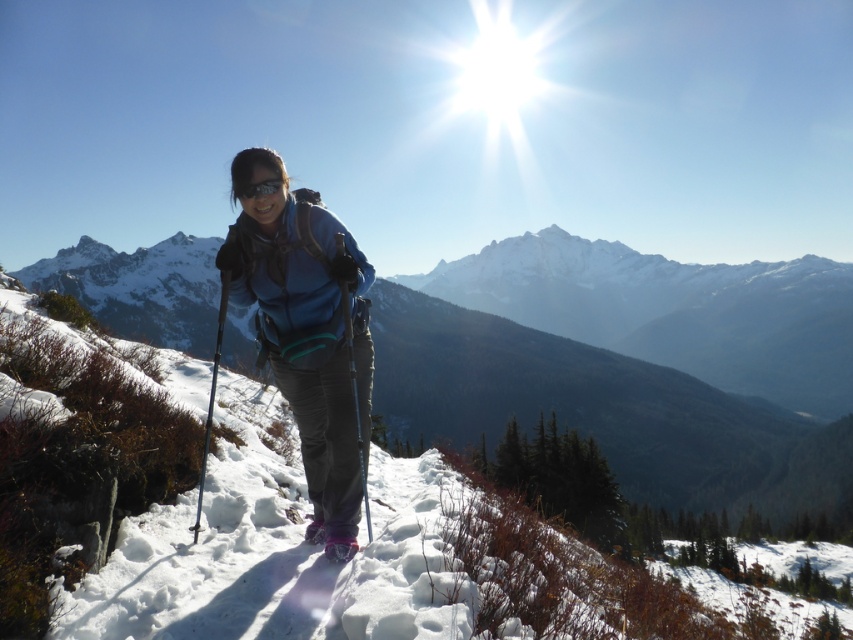
Question: Can you confirm if black metallic ski pole at center is thinner than matte black goggles at center?

Choices:
 (A) no
 (B) yes

Answer: (A)

Question: Is blue fabric jacket at center in front of black metallic ski pole at center?

Choices:
 (A) no
 (B) yes

Answer: (B)

Question: Considering the real-world distances, which object is farthest from the matte black ski pole at center?

Choices:
 (A) black metallic ski pole at center
 (B) blue fabric jacket at center
 (C) matte black goggles at center

Answer: (A)

Question: Which point is closer to the camera?

Choices:
 (A) (288, 280)
 (B) (241, 198)
 (C) (200, 508)
 (D) (357, 396)

Answer: (B)

Question: Which point is farther from the camera taking this photo?

Choices:
 (A) (265, 168)
 (B) (363, 464)
 (C) (202, 461)

Answer: (C)

Question: Is matte black ski pole at center positioned at the back of matte black goggles at center?

Choices:
 (A) no
 (B) yes

Answer: (B)